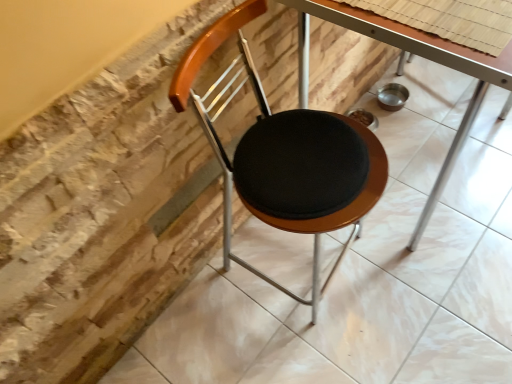
Identify the location of vacant space to the right of matte black seat at center. The width and height of the screenshot is (512, 384). (439, 294).